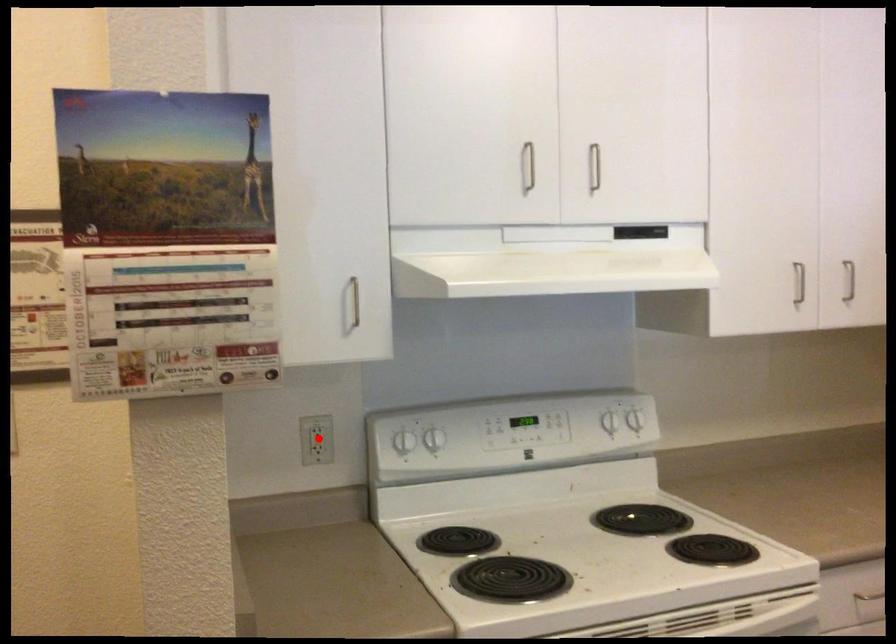
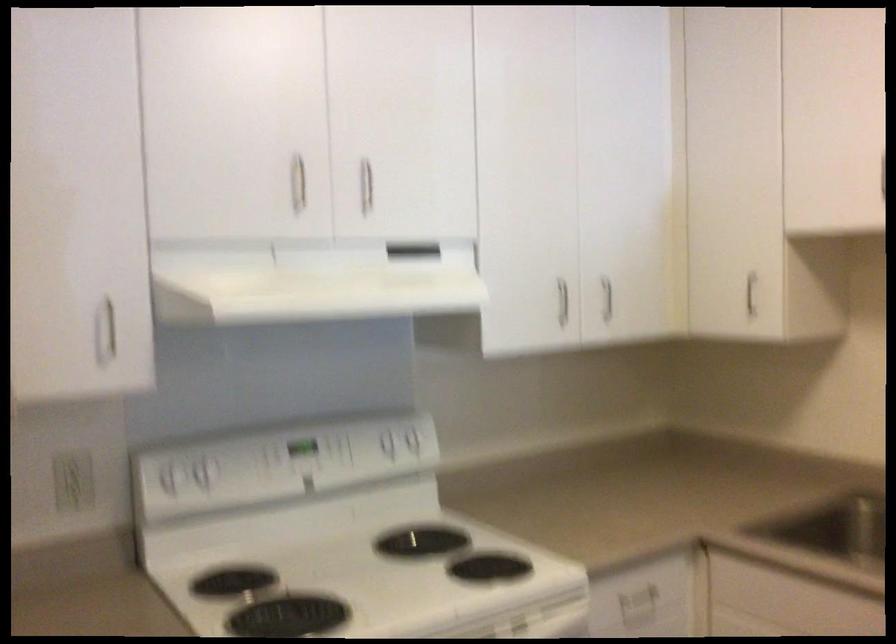
Locate, in the second image, the point that corresponds to the highlighted location in the first image.

(73, 480)